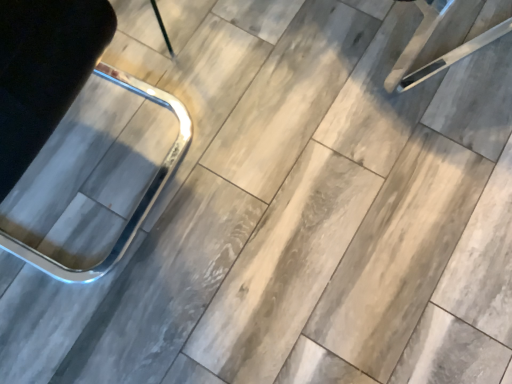
Question: Should I look upward or downward to see metallic chrome chair at left?

Choices:
 (A) down
 (B) up

Answer: (B)